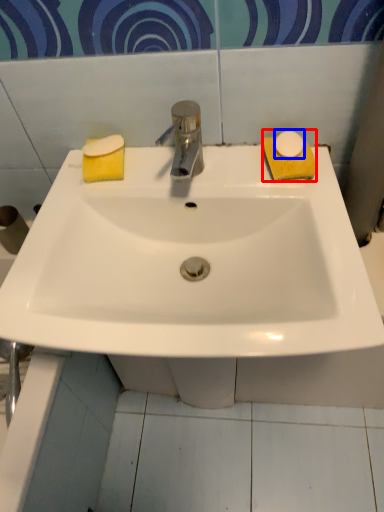
Question: Which object appears closest to the camera in this image, soap (highlighted by a red box) or soap (highlighted by a blue box)?

Choices:
 (A) soap
 (B) soap

Answer: (B)